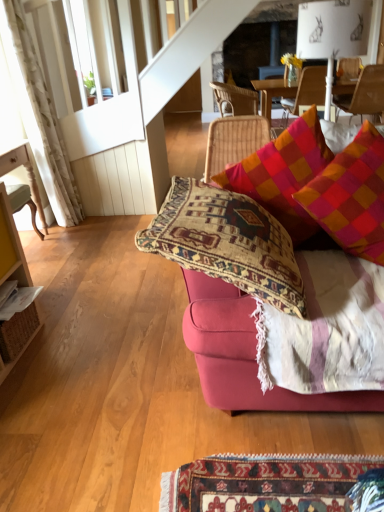
This screenshot has width=384, height=512. What are the coordinates of `vacant position to the left of velvet pink couch at center` in the screenshot? It's located at (109, 375).